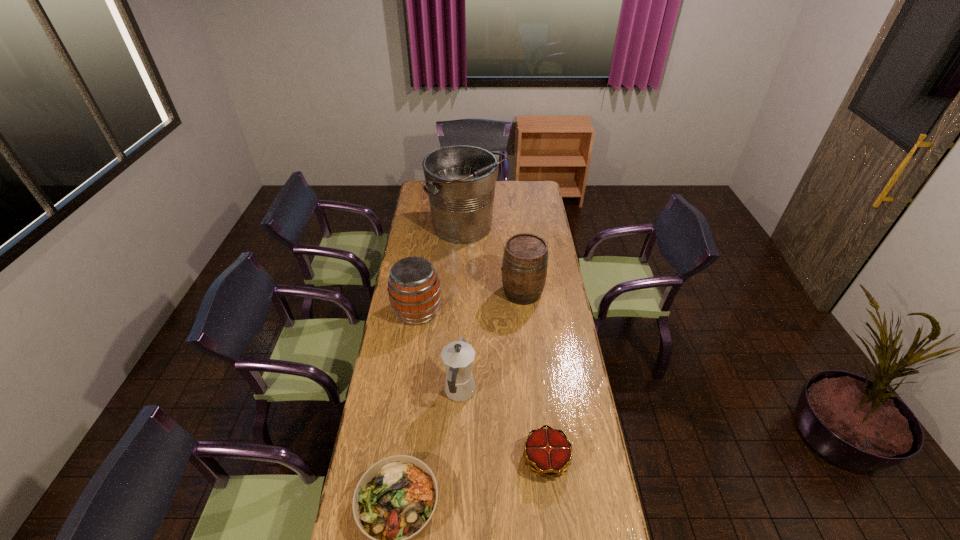
Identify the location of free spot located on the right of the coffeepot. (539, 392).

Identify the location of vacant space situated 0.070m on the back of the left cider. This screenshot has width=960, height=540. (421, 284).

Where is `vacant space situated on the left of the crown`? This screenshot has width=960, height=540. vacant space situated on the left of the crown is located at coordinates (496, 459).

Locate an element on the screen. The image size is (960, 540). bucket located at the left edge is located at coordinates (460, 180).

Image resolution: width=960 pixels, height=540 pixels. Identify the location of cider that is at the left edge. (414, 291).

You are a GUI agent. You are given a task and a screenshot of the screen. Output one action in this format:
    pyautogui.click(x=<x>, y=<y>)
    Task: Click on the cider that is positioned at the right edge
    The height and width of the screenshot is (540, 960).
    Given the screenshot: What is the action you would take?
    pyautogui.click(x=524, y=268)

Find the location of `crown located at the right edge`. crown located at the right edge is located at coordinates click(547, 451).

In order to click on blank space at the left edge of the desktop in this screenshot , I will do `click(434, 240)`.

Where is `free spot at the right edge of the desktop`? free spot at the right edge of the desktop is located at coordinates (541, 329).

Locate an element on the screen. The width and height of the screenshot is (960, 540). vacant space at the far right corner of the desktop is located at coordinates (533, 191).